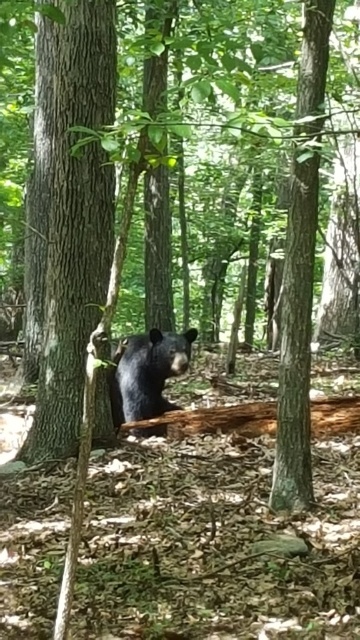
Question: Considering the real-world distances, which object is farthest from the black furry bear at center?

Choices:
 (A) smooth brown tree trunk at left
 (B) brown rough log at center

Answer: (A)

Question: Is smooth brown tree trunk at left to the right of black furry bear at center from the viewer's perspective?

Choices:
 (A) yes
 (B) no

Answer: (B)

Question: Which of the following is the farthest from the observer?

Choices:
 (A) (138, 394)
 (B) (338, 433)

Answer: (A)

Question: Among these objects, which one is nearest to the camera?

Choices:
 (A) smooth brown tree trunk at left
 (B) brown rough log at center
 (C) black furry bear at center

Answer: (A)

Question: Does black furry bear at center have a lesser width compared to brown rough log at center?

Choices:
 (A) yes
 (B) no

Answer: (A)

Question: Considering the relative positions of black furry bear at center and brown rough log at center in the image provided, where is black furry bear at center located with respect to brown rough log at center?

Choices:
 (A) right
 (B) left

Answer: (B)